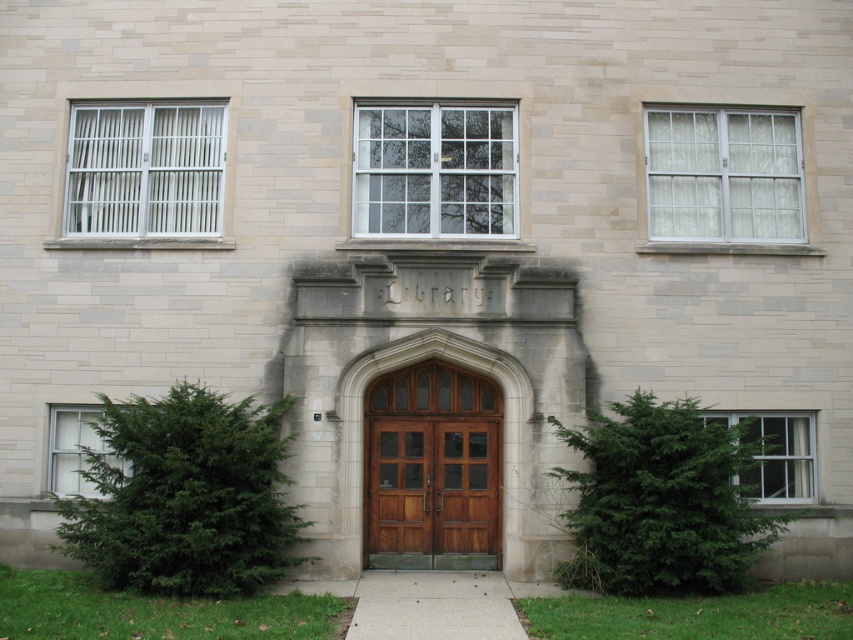
Does white glass window at upper right have a greater width compared to wooden door at center?

Yes.

Between white glass window at upper right and wooden door at center, which one has more height?

wooden door at center is taller.

Is point (741, 237) in front of point (381, 444)?

No, it is not.

Image resolution: width=853 pixels, height=640 pixels. In order to click on white glass window at upper right in this screenshot , I will do `click(723, 173)`.

From the picture: Does white glass window at upper right appear on the left side of white metal bars at upper left?

In fact, white glass window at upper right is to the right of white metal bars at upper left.

Is white glass window at upper right wider than white metal bars at upper left?

Yes.

Who is more forward, (677, 156) or (106, 113)?

Point (677, 156) is more forward.

Identify the location of white glass window at upper right. (723, 173).

Can you confirm if green leafy tree at lower right is smaller than brown wooden door at center?

No, green leafy tree at lower right is not smaller than brown wooden door at center.

Measure the distance between green leafy tree at lower right and camera.

green leafy tree at lower right and camera are 9.62 meters apart.

Where is `green leafy tree at lower right`? The height and width of the screenshot is (640, 853). green leafy tree at lower right is located at coordinates (662, 500).